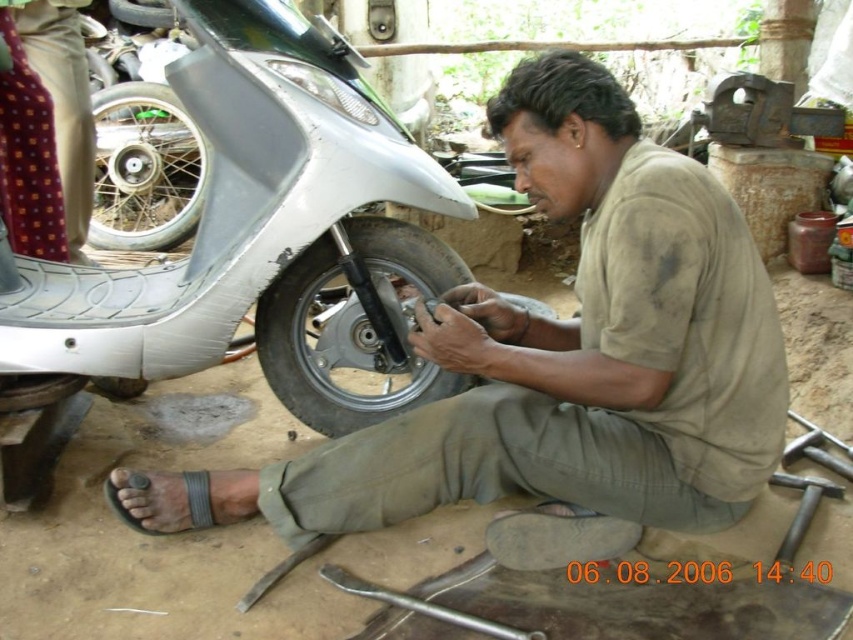
You are an observer in the workshop. You see the brown cotton shirt at center and the polka dot fabric at upper left. Which object is located to the right of the other?

The brown cotton shirt at center is located to the right of the polka dot fabric at upper left.

You are a mechanic who just entered the workshop and need to locate your tools. You remember leaving your favorite wrench near the brown cotton shirt at center and the black rubber tire at center. Which object is positioned to the right of the other?

The brown cotton shirt at center is to the right of the black rubber tire at center.